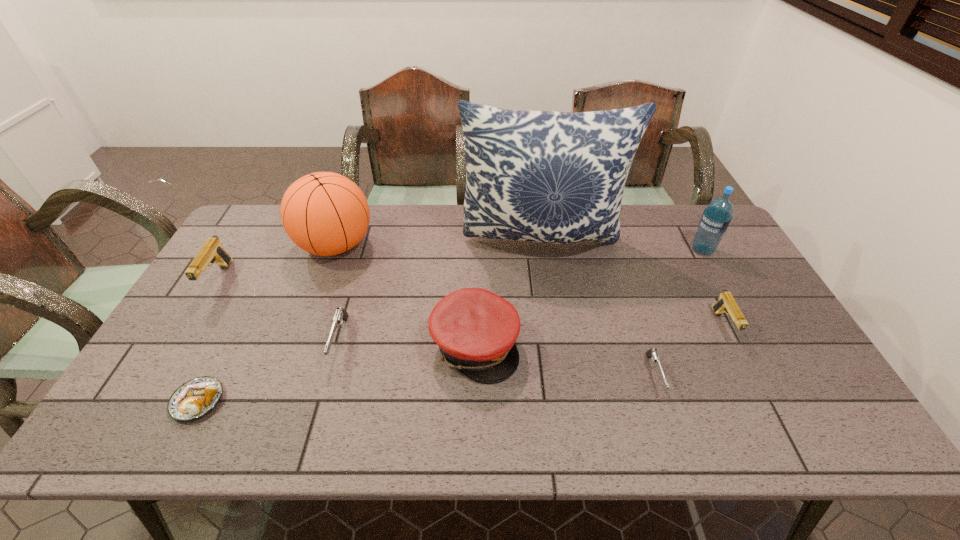
Find the location of a particular element. the left silver pistol is located at coordinates (340, 314).

At what (x,y) coordinates should I click in order to perform the action: click on the bigger silver pistol. Please return your answer as a coordinate pair (x, y). Looking at the image, I should click on (340, 314).

Identify the location of the smaller silver pistol. (652, 353).

This screenshot has width=960, height=540. Find the location of `the right silver pistol`. the right silver pistol is located at coordinates (652, 353).

Where is `the second object from left to right`? The height and width of the screenshot is (540, 960). the second object from left to right is located at coordinates (195, 398).

Image resolution: width=960 pixels, height=540 pixels. Find the location of `the shortest object`. the shortest object is located at coordinates (195, 398).

The width and height of the screenshot is (960, 540). Identify the location of free space located on the front surface of the tallest object. (554, 316).

This screenshot has width=960, height=540. I want to click on free region located 0.150m on the left of the basketball, so click(250, 245).

Locate an element on the screen. blank area located on the right of the water bottle is located at coordinates (733, 250).

In order to click on free space located 0.210m at the barrel of the tallest pistol in this screenshot , I will do `click(168, 362)`.